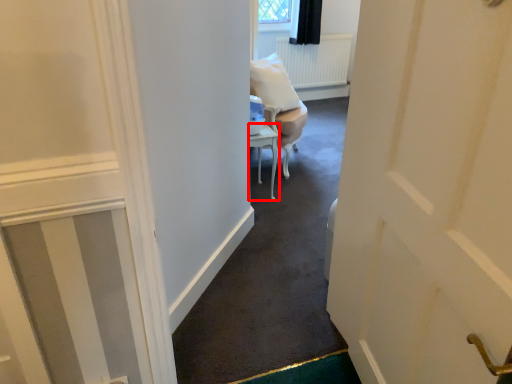
Question: From the image, what is the correct spatial relationship of furniture (annotated by the red box) in relation to chair?

Choices:
 (A) left
 (B) right

Answer: (A)